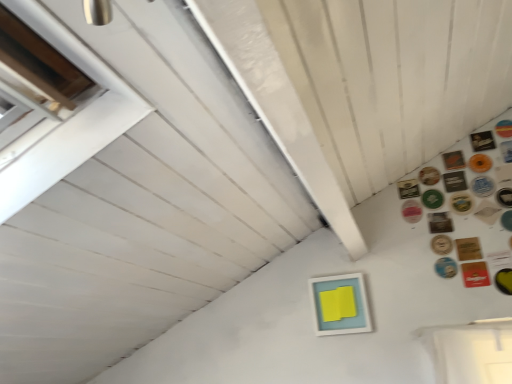
Question: From a real-world perspective, is brown leather coaster at upper right, positioned as the thirteenth button in bottom-to-top order, beneath light blue matte picture frame at center?

Choices:
 (A) no
 (B) yes

Answer: (A)

Question: Is brown leather coaster at upper right, positioned as the thirteenth button in bottom-to-top order, to the right of light blue matte picture frame at center from the viewer's perspective?

Choices:
 (A) no
 (B) yes

Answer: (B)

Question: Is brown leather coaster at upper right, positioned as the thirteenth button in bottom-to-top order, positioned with its back to light blue matte picture frame at center?

Choices:
 (A) yes
 (B) no

Answer: (B)

Question: Does brown leather coaster at upper right, acting as the fifth button starting from the top, have a lesser height compared to light blue matte picture frame at center?

Choices:
 (A) yes
 (B) no

Answer: (A)

Question: Is the position of brown leather coaster at upper right, positioned as the thirteenth button in bottom-to-top order, less distant than that of light blue matte picture frame at center?

Choices:
 (A) yes
 (B) no

Answer: (B)

Question: Does point (484, 276) appear closer or farther from the camera than point (444, 178)?

Choices:
 (A) farther
 (B) closer

Answer: (B)

Question: Is red cardboard button at upper right, which is the 2th button from bottom to top, bigger or smaller than brown leather coaster at upper right, positioned as the thirteenth button in bottom-to-top order?

Choices:
 (A) big
 (B) small

Answer: (A)

Question: Would you say red cardboard button at upper right, positioned as the sixteenth button in top-to-bottom order, is to the left or to the right of brown leather coaster at upper right, acting as the fifth button starting from the top, in the picture?

Choices:
 (A) right
 (B) left

Answer: (A)

Question: In terms of width, does red cardboard button at upper right, which is the 2th button from bottom to top, look wider or thinner when compared to brown leather coaster at upper right, acting as the fifth button starting from the top?

Choices:
 (A) wide
 (B) thin

Answer: (B)

Question: Is point (492, 134) closer or farther from the camera than point (496, 276)?

Choices:
 (A) closer
 (B) farther

Answer: (B)

Question: Relative to yellow rubber at upper right, which ranks as the 1th button in bottom-to-top order, is brown cardboard button at upper right, marked as the 17th button in a bottom-to-top arrangement, in front or behind?

Choices:
 (A) behind
 (B) front

Answer: (A)

Question: From the image's perspective, is brown cardboard button at upper right, arranged as the first button when viewed from the top, positioned above or below yellow rubber at upper right, which appears as the 17th button when viewed from the top?

Choices:
 (A) above
 (B) below

Answer: (A)

Question: In terms of height, does brown cardboard button at upper right, marked as the 17th button in a bottom-to-top arrangement, look taller or shorter compared to yellow rubber at upper right, which appears as the 17th button when viewed from the top?

Choices:
 (A) tall
 (B) short

Answer: (B)

Question: Based on their sizes in the image, would you say light blue matte picture frame at center is bigger or smaller than pink glossy button at upper right, arranged as the 11th button when viewed from the top?

Choices:
 (A) small
 (B) big

Answer: (B)

Question: Is point (328, 279) closer or farther from the camera than point (415, 210)?

Choices:
 (A) farther
 (B) closer

Answer: (A)